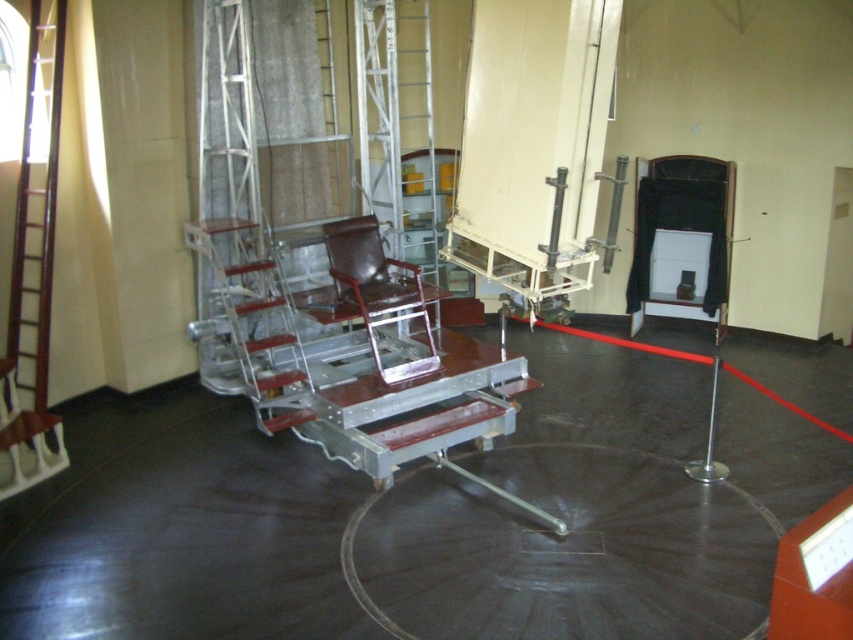
Is metallic silver ladder at left below leather-like brown chair at center?

Incorrect, metallic silver ladder at left is not positioned below leather-like brown chair at center.

The height and width of the screenshot is (640, 853). Identify the location of metallic silver ladder at left. (239, 241).

Based on the photo, who is more forward, (33, 474) or (357, 294)?

Point (33, 474)

Is wooden ladder at left shorter than leather-like brown chair at center?

No, wooden ladder at left is not shorter than leather-like brown chair at center.

Measure the distance between point (16, 260) and camera.

They are 5.35 meters apart.

In order to click on wooden ladder at left in this screenshot , I will do `click(33, 264)`.

Between metallic silver ladder at left and wooden ladder at left, which one is positioned lower?

wooden ladder at left

The height and width of the screenshot is (640, 853). What do you see at coordinates (239, 241) in the screenshot?
I see `metallic silver ladder at left` at bounding box center [239, 241].

Is point (247, 385) in front of point (45, 26)?

No, (247, 385) is behind (45, 26).

Find the location of a particular element. The width and height of the screenshot is (853, 640). metallic silver ladder at left is located at coordinates (239, 241).